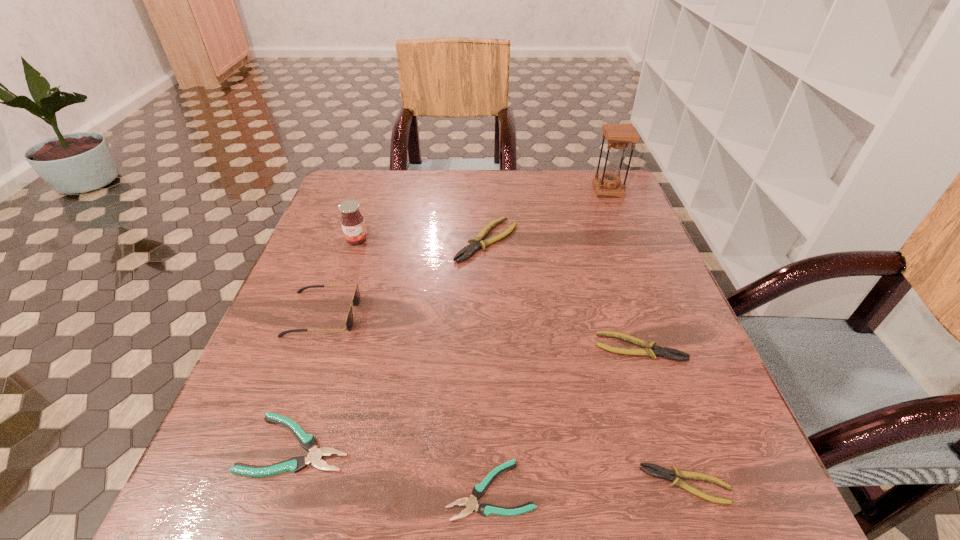
What are the coordinates of `the tallest object` in the screenshot? It's located at (618, 136).

The width and height of the screenshot is (960, 540). Identify the location of the farthest object. (618, 136).

This screenshot has width=960, height=540. I want to click on jam, so click(352, 221).

Where is `black sunglasses`? Image resolution: width=960 pixels, height=540 pixels. black sunglasses is located at coordinates (355, 300).

Identify the location of the sixth shortest object. (355, 300).

I want to click on the tallest pliers, so point(477,243).

This screenshot has width=960, height=540. What are the coordinates of `the farthest pliers` in the screenshot? It's located at (477, 243).

This screenshot has height=540, width=960. Find the location of `the fourth nearest pliers`. the fourth nearest pliers is located at coordinates (649, 349).

Where is `the second smallest yellow pliers`? the second smallest yellow pliers is located at coordinates (649, 349).

Identify the location of the left teal pliers. (308, 442).